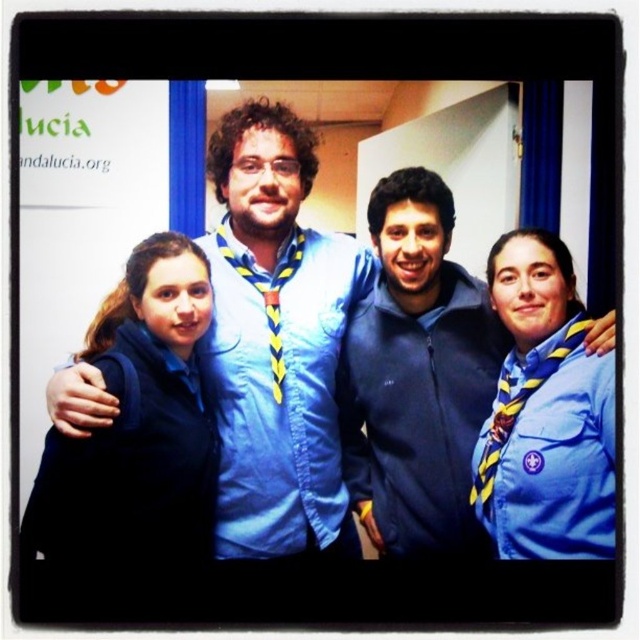
Question: Based on their relative distances, which object is farther from the blue denim shirt at center?

Choices:
 (A) matte blue uniform at left
 (B) blue fabric uniform at right

Answer: (B)

Question: From the image, what is the correct spatial relationship of blue denim shirt at center in relation to matte blue uniform at left?

Choices:
 (A) below
 (B) above

Answer: (B)

Question: Is blue fabric shirt at center positioned at the back of blue fabric uniform at right?

Choices:
 (A) yes
 (B) no

Answer: (A)

Question: Is blue denim shirt at center below blue fabric shirt at center?

Choices:
 (A) yes
 (B) no

Answer: (B)

Question: Which object is farther from the camera taking this photo?

Choices:
 (A) blue fabric shirt at center
 (B) navy blue fleece jacket at center

Answer: (B)

Question: Among these objects, which one is farthest from the camera?

Choices:
 (A) matte blue uniform at left
 (B) blue fabric shirt at center

Answer: (B)